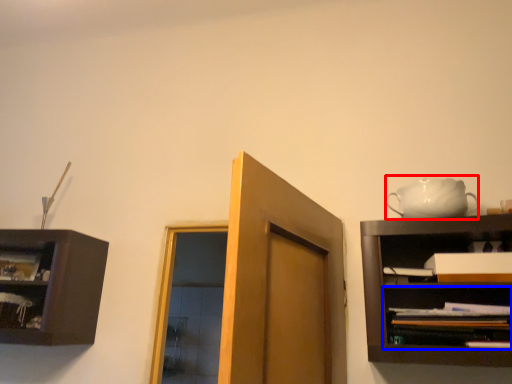
Question: Which object is further to the camera taking this photo, tea set (highlighted by a red box) or shelf (highlighted by a blue box)?

Choices:
 (A) tea set
 (B) shelf

Answer: (A)